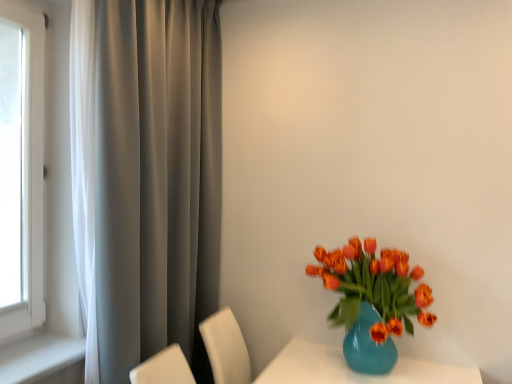
Question: Considering the positions of shiny orange tulips in glass vase at right and satin gray curtain at left in the image, is shiny orange tulips in glass vase at right taller or shorter than satin gray curtain at left?

Choices:
 (A) short
 (B) tall

Answer: (A)

Question: From the image's perspective, is shiny orange tulips in glass vase at right located above or below satin gray curtain at left?

Choices:
 (A) below
 (B) above

Answer: (A)

Question: Is shiny orange tulips in glass vase at right in front of or behind satin gray curtain at left in the image?

Choices:
 (A) front
 (B) behind

Answer: (B)

Question: Would you say satin gray curtain at left is to the left or to the right of shiny orange tulips in glass vase at right in the picture?

Choices:
 (A) right
 (B) left

Answer: (B)

Question: Looking at their shapes, would you say satin gray curtain at left is wider or thinner than shiny orange tulips in glass vase at right?

Choices:
 (A) thin
 (B) wide

Answer: (A)

Question: Considering the positions of point (137, 56) and point (337, 266), is point (137, 56) closer or farther from the camera than point (337, 266)?

Choices:
 (A) closer
 (B) farther

Answer: (A)

Question: Relative to shiny orange tulips in glass vase at right, is satin gray curtain at left in front or behind?

Choices:
 (A) behind
 (B) front

Answer: (B)